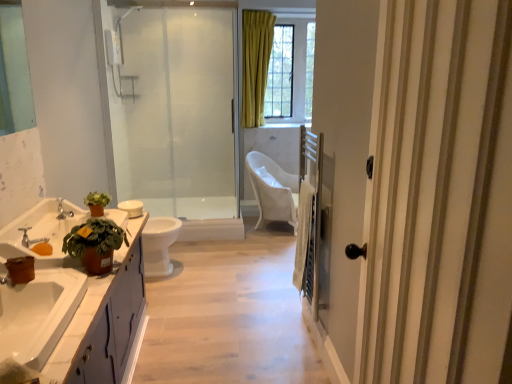
Question: From the image's perspective, relative to wooden balustrade at right, is white glossy toilet bowl at center above or below?

Choices:
 (A) above
 (B) below

Answer: (A)

Question: In terms of height, does white glossy toilet bowl at center look taller or shorter compared to wooden balustrade at right?

Choices:
 (A) short
 (B) tall

Answer: (A)

Question: Which object is positioned farthest from the white glossy sink at lower left, the second sink when ordered from front to back?

Choices:
 (A) silver metallic faucet at lower left, the 2th tap in the top-to-bottom sequence
 (B) white wood door at right
 (C) white glossy cabinet at lower left
 (D) wooden balustrade at right
 (E) white glossy cabinet at lower left

Answer: (B)

Question: Which object is positioned closest to the white wood door at right?

Choices:
 (A) white glossy cabinet at lower left
 (B) white glossy toilet at center
 (C) silver metallic faucet at lower left, the 1th tap from the front
 (D) woven white chair at center
 (E) white glossy sink at lower left, which is the first sink in front-to-back order

Answer: (A)